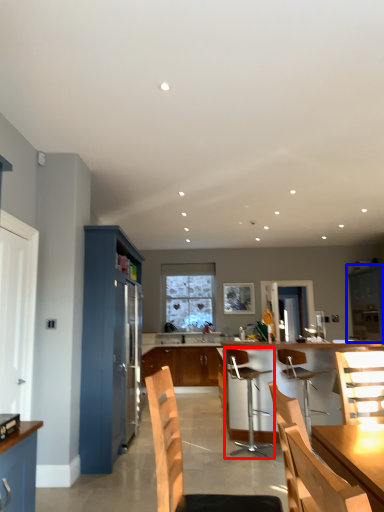
Question: Which point is closer to the camera, chair (highlighted by a red box) or cabinetry (highlighted by a blue box)?

Choices:
 (A) chair
 (B) cabinetry

Answer: (A)